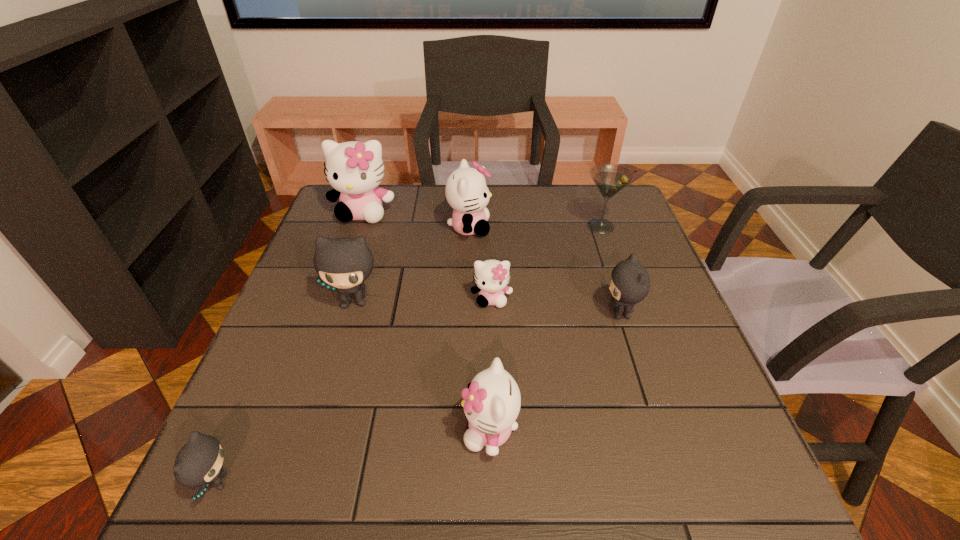
At what (x,y) coordinates should I click in order to perform the action: click on the leftmost white kitten. Please return your answer as a coordinate pair (x, y). The image size is (960, 540). Looking at the image, I should click on (354, 169).

Image resolution: width=960 pixels, height=540 pixels. Identify the location of the biggest white kitten. (354, 169).

Identify the location of the second biggest white kitten. This screenshot has height=540, width=960. tap(466, 190).

Find the location of `martini`. martini is located at coordinates (610, 179).

Where is `the second gray kitten from right to left`? the second gray kitten from right to left is located at coordinates (343, 264).

Locate an element on the screen. the second smallest white kitten is located at coordinates (492, 401).

The image size is (960, 540). I want to click on the rightmost gray kitten, so click(x=629, y=284).

The width and height of the screenshot is (960, 540). Find the location of `the rightmost kitten`. the rightmost kitten is located at coordinates (629, 284).

The image size is (960, 540). I want to click on the third farthest white kitten, so click(491, 276).

What are the coordinates of `the nearest gray kitten` in the screenshot? It's located at point(199,462).